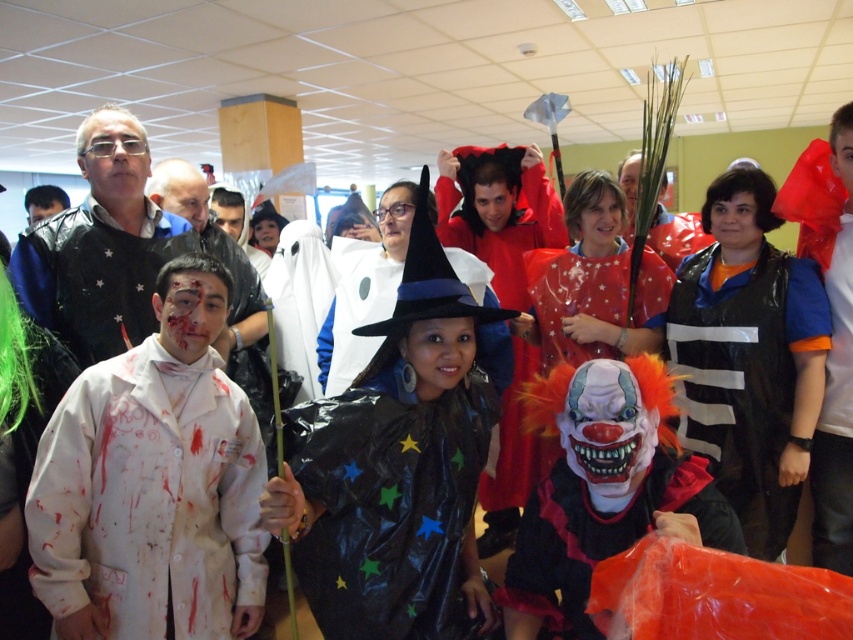
Which is in front, point (334, 451) or point (114, 602)?

Point (334, 451) is in front.

Does shiny black cape at center appear over white matte lab coat at left?

Yes.

Who is more distant from viewer, (x=364, y=570) or (x=45, y=440)?

The point (x=45, y=440) is behind.

I want to click on shiny black cape at center, so click(396, 467).

Is shiny black cape at center bigger than black plastic vest at center-right?

Yes, shiny black cape at center is bigger than black plastic vest at center-right.

I want to click on shiny black cape at center, so click(396, 467).

In order to click on shiny black cape at center in this screenshot , I will do `click(396, 467)`.

Is point (154, 416) more distant than point (795, 492)?

That is False.

Is point (163, 624) closer to viewer compared to point (781, 499)?

That is True.

The width and height of the screenshot is (853, 640). Find the location of `white matte lab coat at left`. white matte lab coat at left is located at coordinates (149, 497).

At what (x,y) coordinates should I click in order to perform the action: click on white matte lab coat at left. Please return your answer as a coordinate pair (x, y). The image size is (853, 640). Looking at the image, I should click on click(x=149, y=497).